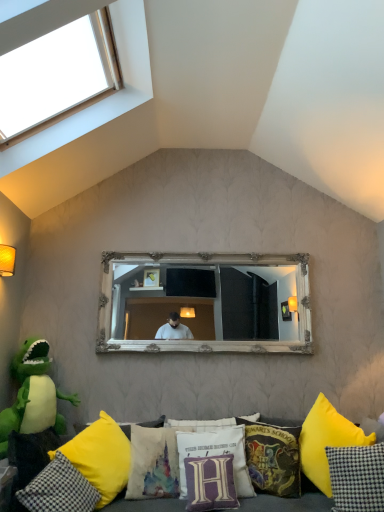
Question: Does white fabric pillow with purple lettering at center, marked as the fourth pillow in a right-to-left arrangement, contain matte yellow wall sconce at left?

Choices:
 (A) no
 (B) yes

Answer: (A)

Question: Is white fabric pillow with purple lettering at center, the fifth pillow positioned from the left, to the left of matte yellow wall sconce at left from the viewer's perspective?

Choices:
 (A) yes
 (B) no

Answer: (B)

Question: From the image's perspective, is white fabric pillow with purple lettering at center, the fifth pillow positioned from the left, located beneath matte yellow wall sconce at left?

Choices:
 (A) no
 (B) yes

Answer: (B)

Question: From the image's perspective, does white fabric pillow with purple lettering at center, the fifth pillow positioned from the left, appear higher than matte yellow wall sconce at left?

Choices:
 (A) no
 (B) yes

Answer: (A)

Question: Considering the relative positions of white fabric pillow with purple lettering at center, the fifth pillow positioned from the left, and matte yellow wall sconce at left in the image provided, is white fabric pillow with purple lettering at center, the fifth pillow positioned from the left, behind matte yellow wall sconce at left?

Choices:
 (A) no
 (B) yes

Answer: (A)

Question: Considering the relative sizes of white fabric pillow with purple lettering at center, the fifth pillow positioned from the left, and matte yellow wall sconce at left in the image provided, is white fabric pillow with purple lettering at center, the fifth pillow positioned from the left, bigger than matte yellow wall sconce at left?

Choices:
 (A) yes
 (B) no

Answer: (A)

Question: Considering the relative sizes of matte yellow wall sconce at left and yellow fabric pillow at lower right, the second pillow from the right, in the image provided, is matte yellow wall sconce at left wider than yellow fabric pillow at lower right, the second pillow from the right,?

Choices:
 (A) no
 (B) yes

Answer: (A)

Question: Are matte yellow wall sconce at left and yellow fabric pillow at lower right, placed as the 7th pillow when sorted from left to right, located far from each other?

Choices:
 (A) no
 (B) yes

Answer: (B)

Question: Is matte yellow wall sconce at left thinner than yellow fabric pillow at lower right, placed as the 7th pillow when sorted from left to right?

Choices:
 (A) yes
 (B) no

Answer: (A)

Question: Is matte yellow wall sconce at left to the left of yellow fabric pillow at lower right, placed as the 7th pillow when sorted from left to right, from the viewer's perspective?

Choices:
 (A) no
 (B) yes

Answer: (B)

Question: Is matte yellow wall sconce at left aimed at yellow fabric pillow at lower right, placed as the 7th pillow when sorted from left to right?

Choices:
 (A) no
 (B) yes

Answer: (A)

Question: Could yellow fabric pillow at lower right, placed as the 7th pillow when sorted from left to right, be considered to be inside matte yellow wall sconce at left?

Choices:
 (A) no
 (B) yes

Answer: (A)

Question: From a real-world perspective, is yellow fabric couch at lower center below yellow fabric pillow at lower left, the 1th pillow in the left-to-right sequence?

Choices:
 (A) yes
 (B) no

Answer: (A)